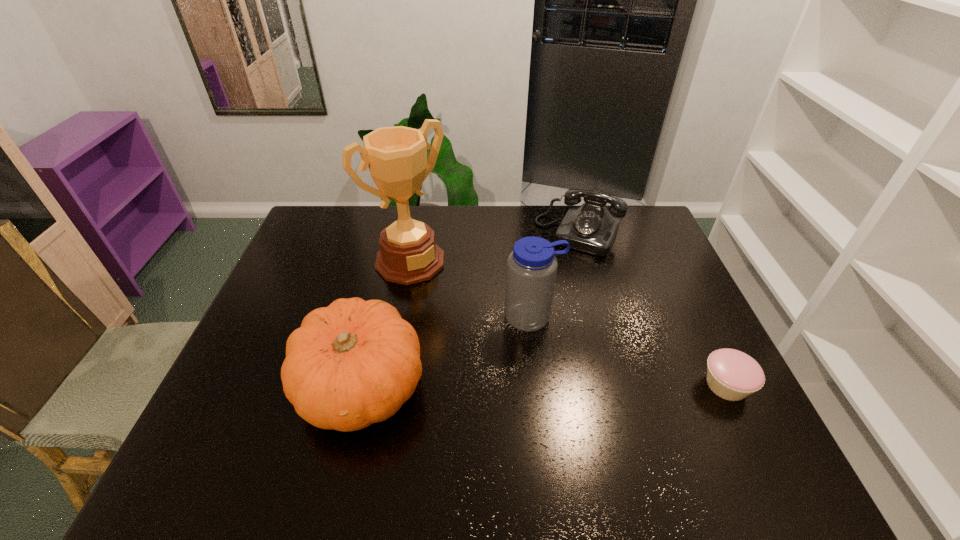
Image resolution: width=960 pixels, height=540 pixels. I want to click on vacant spot on the desktop that is between the third shortest object and the cupcake and is positioned on the front-facing side of the tallest object, so point(540,386).

Identify the location of free spot on the desktop that is between the third tallest object and the shortest object and is positioned with a carrying loop on the side of the third farthest object. Image resolution: width=960 pixels, height=540 pixels. (555, 386).

Identify the location of free space on the desktop that is between the pumpkin and the shortest object and is positioned on the dial of the second shortest object. This screenshot has height=540, width=960. (502, 386).